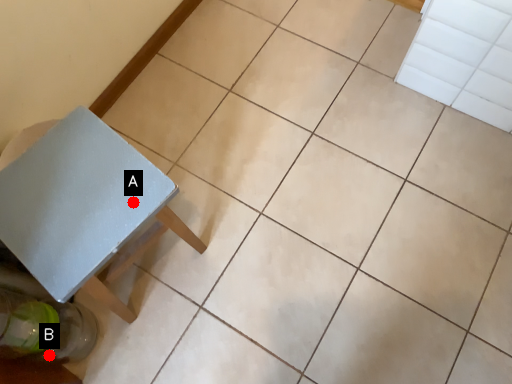
Question: Two points are circled on the image, labeled by A and B beside each circle. Which of the following is the farthest from the observer?

Choices:
 (A) A is further
 (B) B is further

Answer: (B)